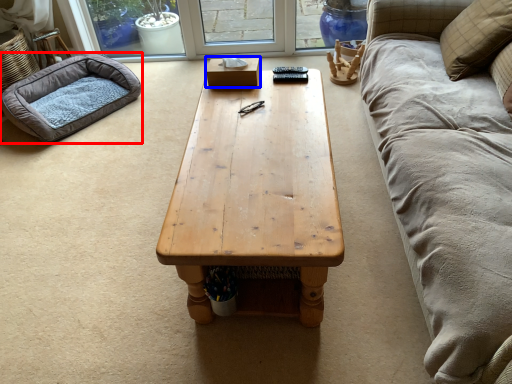
Question: Among these objects, which one is nearest to the camera, dog bed (highlighted by a red box) or box (highlighted by a blue box)?

Choices:
 (A) dog bed
 (B) box

Answer: (B)